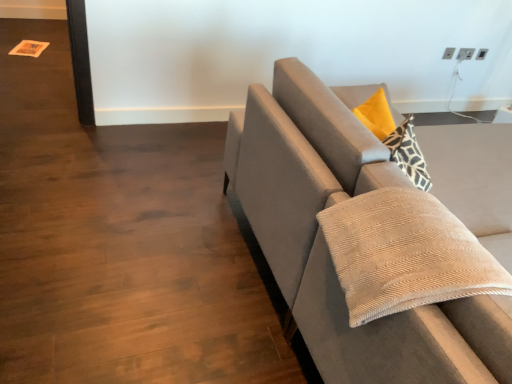
What do you see at coordinates (405, 254) in the screenshot?
I see `beige corduroy pillow at right` at bounding box center [405, 254].

Measure the distance between point (490, 280) and camera.

Point (490, 280) and camera are 33.94 inches apart.

In order to face beige corduroy pillow at right, should I rotate leftwards or rightwards?

To align with it, rotate right about 23.124°.

What is the approximate width of beige corduroy pillow at right?

It is 19.10 inches.

At what (x,y) coordinates should I click in order to perform the action: click on beige corduroy pillow at right. Please return your answer as a coordinate pair (x, y). Looking at the image, I should click on (405, 254).

Image resolution: width=512 pixels, height=384 pixels. What do you see at coordinates (327, 246) in the screenshot?
I see `velvet gray couch at right` at bounding box center [327, 246].

The width and height of the screenshot is (512, 384). I want to click on velvet gray couch at right, so click(x=327, y=246).

Consider the image. Measure the distance between velvet gray couch at right and camera.

velvet gray couch at right and camera are 30.85 inches apart.

This screenshot has width=512, height=384. I want to click on beige corduroy pillow at right, so click(405, 254).

Does velvet gray couch at right appear on the right side of beige corduroy pillow at right?

Correct, you'll find velvet gray couch at right to the right of beige corduroy pillow at right.

Relative to beige corduroy pillow at right, is velvet gray couch at right in front or behind?

velvet gray couch at right is behind beige corduroy pillow at right.

Is point (479, 214) closer to viewer compared to point (480, 282)?

No, (479, 214) is behind (480, 282).

From the image's perspective, relative to beige corduroy pillow at right, is velvet gray couch at right above or below?

velvet gray couch at right is situated higher than beige corduroy pillow at right in the image.

From a real-world perspective, which is physically below, velvet gray couch at right or beige corduroy pillow at right?

velvet gray couch at right, from a real-world perspective.

In terms of width, does velvet gray couch at right look wider or thinner when compared to beige corduroy pillow at right?

velvet gray couch at right is wider than beige corduroy pillow at right.

Who is taller, velvet gray couch at right or beige corduroy pillow at right?

velvet gray couch at right is taller.

Is velvet gray couch at right bigger than beige corduroy pillow at right?

Yes.

Is velvet gray couch at right not inside beige corduroy pillow at right?

velvet gray couch at right lies outside beige corduroy pillow at right's area.

Are velvet gray couch at right and beige corduroy pillow at right beside each other?

velvet gray couch at right is not next to beige corduroy pillow at right, and they're not touching.

Is velvet gray couch at right oriented towards beige corduroy pillow at right?

No, velvet gray couch at right does not turn towards beige corduroy pillow at right.

How far apart are velvet gray couch at right and beige corduroy pillow at right?

velvet gray couch at right is 6.63 inches from beige corduroy pillow at right.

This screenshot has height=384, width=512. Identify the location of pillow in front of the velvet gray couch at right. (405, 254).

Can you confirm if beige corduroy pillow at right is positioned to the right of velvet gray couch at right?

Incorrect, beige corduroy pillow at right is not on the right side of velvet gray couch at right.

Who is more distant, beige corduroy pillow at right or velvet gray couch at right?

velvet gray couch at right is further from the camera.

Which is nearer, (x=451, y=243) or (x=297, y=316)?

Point (x=451, y=243).

From the image's perspective, which one is positioned lower, beige corduroy pillow at right or velvet gray couch at right?

From the image's view, beige corduroy pillow at right is below.

From a real-world perspective, does beige corduroy pillow at right sit lower than velvet gray couch at right?

No.

Does beige corduroy pillow at right have a lesser width compared to velvet gray couch at right?

Yes, beige corduroy pillow at right is thinner than velvet gray couch at right.

Does beige corduroy pillow at right have a lesser height compared to velvet gray couch at right?

Indeed, beige corduroy pillow at right has a lesser height compared to velvet gray couch at right.

Can you confirm if beige corduroy pillow at right is bigger than velvet gray couch at right?

Incorrect, beige corduroy pillow at right is not larger than velvet gray couch at right.

Is velvet gray couch at right inside beige corduroy pillow at right?

That's incorrect, velvet gray couch at right is not inside beige corduroy pillow at right.

Is beige corduroy pillow at right next to velvet gray couch at right and touching it?

beige corduroy pillow at right and velvet gray couch at right are not in contact.

Is beige corduroy pillow at right looking in the opposite direction of velvet gray couch at right?

That's not correct — beige corduroy pillow at right is not looking away from velvet gray couch at right.

Identify the location of pillow located in front of the velvet gray couch at right. (405, 254).

Find the location of `pillow located above the velvet gray couch at right (from a real-world perspective)`. pillow located above the velvet gray couch at right (from a real-world perspective) is located at coordinates (405, 254).

At what (x,y) coordinates should I click in order to perform the action: click on studio couch on the right of beige corduroy pillow at right. Please return your answer as a coordinate pair (x, y). Looking at the image, I should click on (327, 246).